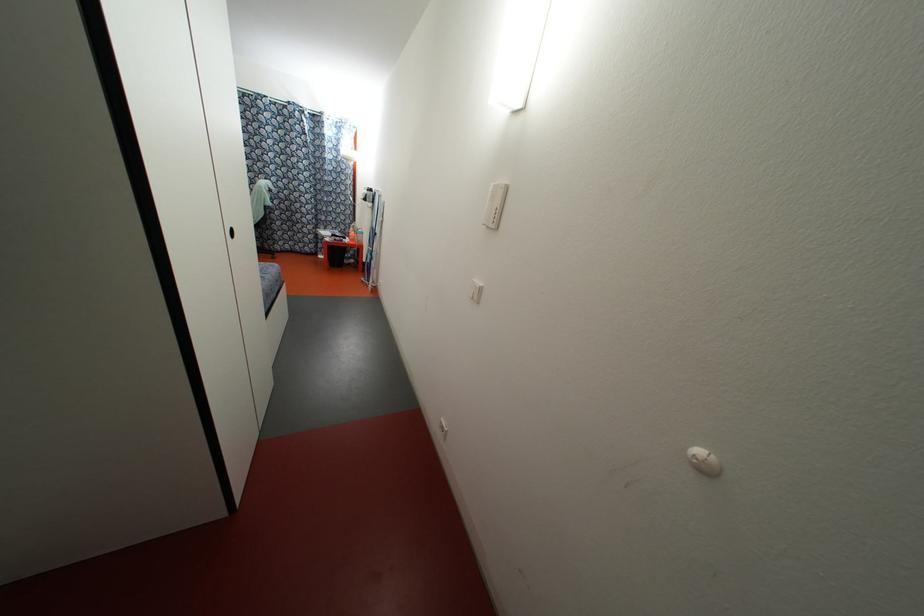
Image resolution: width=924 pixels, height=616 pixels. What do you see at coordinates (494, 205) in the screenshot?
I see `a intercom buttons` at bounding box center [494, 205].